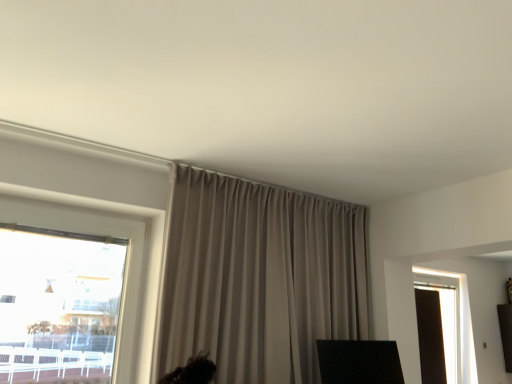
Question: Considering the relative sizes of matte glass window at right and beige fabric curtain at center in the image provided, is matte glass window at right taller than beige fabric curtain at center?

Choices:
 (A) yes
 (B) no

Answer: (A)

Question: From a real-world perspective, is matte glass window at right located higher than beige fabric curtain at center?

Choices:
 (A) no
 (B) yes

Answer: (A)

Question: Is matte glass window at right far away from beige fabric curtain at center?

Choices:
 (A) no
 (B) yes

Answer: (B)

Question: From the image's perspective, would you say matte glass window at right is shown under beige fabric curtain at center?

Choices:
 (A) yes
 (B) no

Answer: (A)

Question: Is matte glass window at right aimed at beige fabric curtain at center?

Choices:
 (A) yes
 (B) no

Answer: (B)

Question: Is the depth of matte glass window at right less than that of beige fabric curtain at center?

Choices:
 (A) yes
 (B) no

Answer: (B)

Question: Is beige fabric curtain at center positioned with its back to matte glass window at right?

Choices:
 (A) no
 (B) yes

Answer: (A)

Question: From a real-world perspective, is beige fabric curtain at center over matte glass window at right?

Choices:
 (A) no
 (B) yes

Answer: (B)

Question: Is beige fabric curtain at center wider than matte glass window at right?

Choices:
 (A) no
 (B) yes

Answer: (A)

Question: Can you confirm if beige fabric curtain at center is thinner than matte glass window at right?

Choices:
 (A) no
 (B) yes

Answer: (B)

Question: Is beige fabric curtain at center positioned far away from matte glass window at right?

Choices:
 (A) no
 (B) yes

Answer: (B)

Question: Is beige fabric curtain at center positioned behind matte glass window at right?

Choices:
 (A) yes
 (B) no

Answer: (B)

Question: Do you think matte glass window at right is within beige fabric curtain at center, or outside of it?

Choices:
 (A) outside
 (B) inside

Answer: (A)